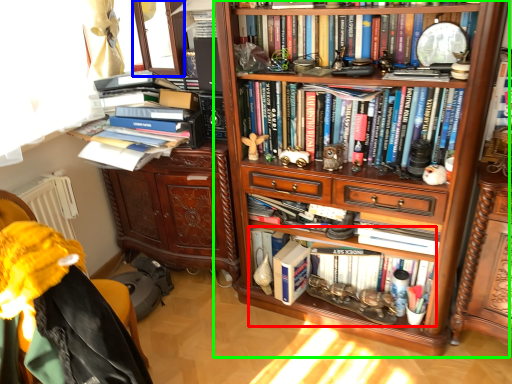
Question: Considering the real-world distances, which object is farthest from book (highlighted by a red box)? window screen (highlighted by a blue box) or bookcase (highlighted by a green box)?

Choices:
 (A) window screen
 (B) bookcase

Answer: (A)